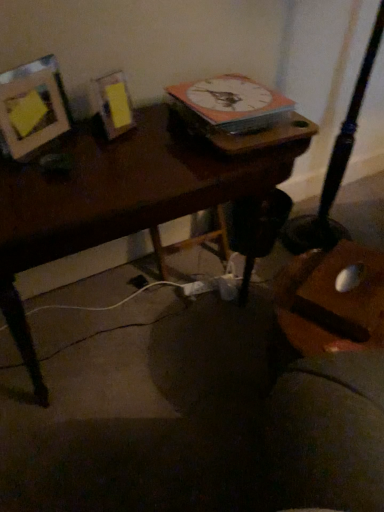
Question: Is matte wood picture frame at upper left next to wooden desk at center and touching it?

Choices:
 (A) no
 (B) yes

Answer: (A)

Question: Is matte wood picture frame at upper left taller than wooden desk at center?

Choices:
 (A) yes
 (B) no

Answer: (B)

Question: Could you tell me if matte wood picture frame at upper left is facing wooden desk at center?

Choices:
 (A) yes
 (B) no

Answer: (B)

Question: From the image's perspective, is matte wood picture frame at upper left under wooden desk at center?

Choices:
 (A) no
 (B) yes

Answer: (A)

Question: Is matte wood picture frame at upper left to the left of wooden desk at center from the viewer's perspective?

Choices:
 (A) yes
 (B) no

Answer: (A)

Question: From the image's perspective, is wooden desk at center positioned above or below matte wood picture frame at upper left?

Choices:
 (A) above
 (B) below

Answer: (B)

Question: From their relative heights in the image, would you say wooden desk at center is taller or shorter than matte wood picture frame at upper left?

Choices:
 (A) short
 (B) tall

Answer: (B)

Question: Looking at their shapes, would you say wooden desk at center is wider or thinner than matte wood picture frame at upper left?

Choices:
 (A) thin
 (B) wide

Answer: (B)

Question: Is wooden desk at center situated inside matte wood picture frame at upper left or outside?

Choices:
 (A) outside
 (B) inside

Answer: (A)

Question: Considering the relative positions of white glossy clock at upper center and matte wood picture frame at upper left in the image provided, is white glossy clock at upper center to the left or to the right of matte wood picture frame at upper left?

Choices:
 (A) left
 (B) right

Answer: (B)

Question: From the image's perspective, is white glossy clock at upper center above or below matte wood picture frame at upper left?

Choices:
 (A) below
 (B) above

Answer: (B)

Question: Looking at the image, does white glossy clock at upper center seem bigger or smaller compared to matte wood picture frame at upper left?

Choices:
 (A) big
 (B) small

Answer: (A)

Question: Is point (271, 96) closer or farther from the camera than point (31, 105)?

Choices:
 (A) farther
 (B) closer

Answer: (A)

Question: In the image, is white glossy clock at upper center positioned in front of or behind wooden desk at center?

Choices:
 (A) behind
 (B) front

Answer: (A)

Question: Would you say white glossy clock at upper center is inside or outside wooden desk at center?

Choices:
 (A) inside
 (B) outside

Answer: (B)